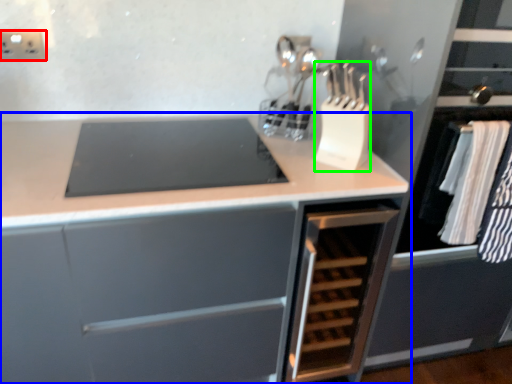
Question: Which is nearer to the electric outlet (highlighted by a red box)? cabinetry (highlighted by a blue box) or kitchen appliance (highlighted by a green box).

Choices:
 (A) cabinetry
 (B) kitchen appliance

Answer: (A)